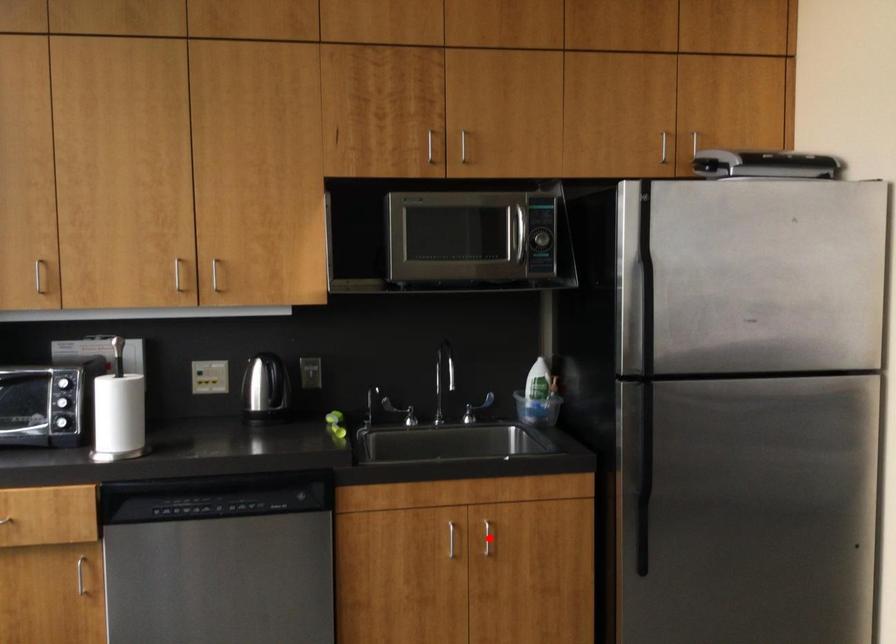
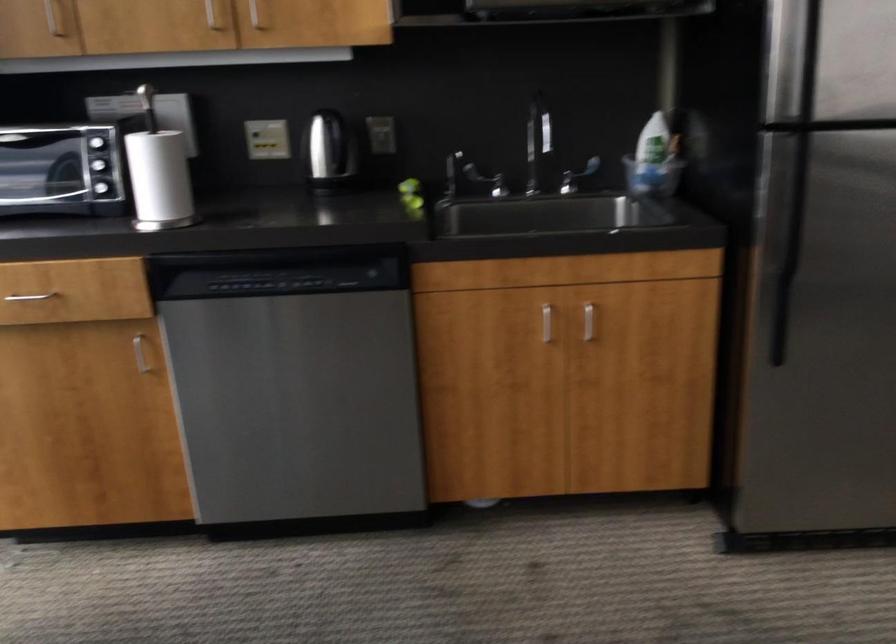
The point at the highlighted location is marked in the first image. Where is the corresponding point in the second image?

(588, 321)